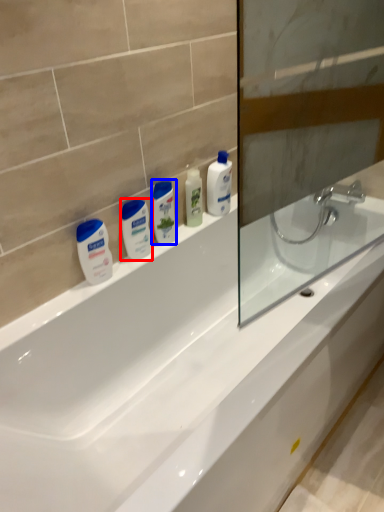
Question: Which object is closer to the camera taking this photo, mouthwash (highlighted by a red box) or mouthwash (highlighted by a blue box)?

Choices:
 (A) mouthwash
 (B) mouthwash

Answer: (A)